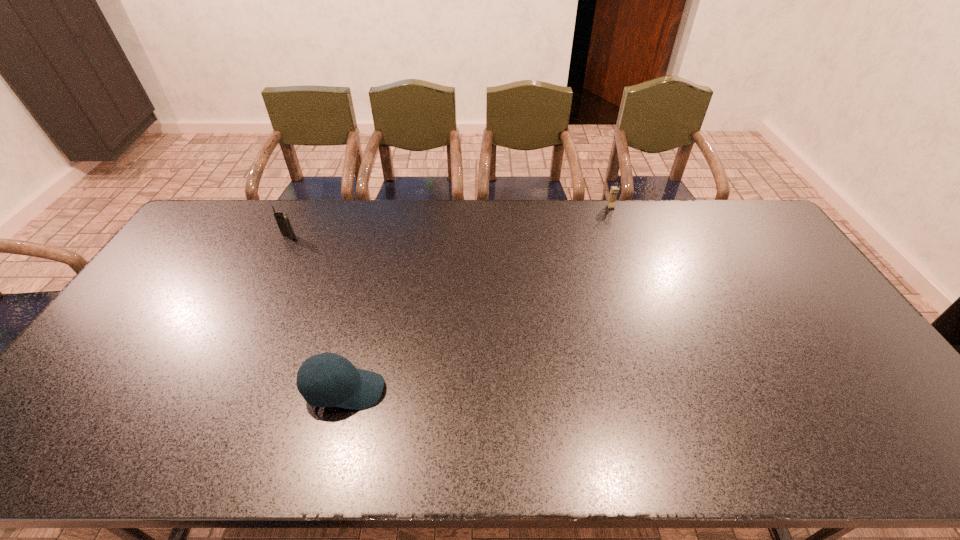
The image size is (960, 540). What are the coordinates of `vacant position at the near edge of the desktop` in the screenshot? It's located at (559, 463).

Find the location of a particular element. vacant space at the left edge of the desktop is located at coordinates (97, 372).

Image resolution: width=960 pixels, height=540 pixels. In the image, there is a desktop. Identify the location of free space at the right edge. (858, 346).

Where is `free space between the second object from left to right and the nearer cellular telephone`? This screenshot has width=960, height=540. free space between the second object from left to right and the nearer cellular telephone is located at coordinates (317, 313).

Locate an element on the screen. The width and height of the screenshot is (960, 540). empty location between the rightmost object and the leftmost object is located at coordinates (450, 222).

At what (x,y) coordinates should I click in order to perform the action: click on vacant area that lies between the left cellular telephone and the nearest object. Please return your answer as a coordinate pair (x, y). Looking at the image, I should click on (317, 313).

In order to click on free area in between the second farthest object and the right cellular telephone in this screenshot , I will do (x=450, y=222).

Locate an element on the screen. Image resolution: width=960 pixels, height=540 pixels. empty location between the baseball cap and the right cellular telephone is located at coordinates (478, 299).

You are a GUI agent. You are given a task and a screenshot of the screen. Output one action in this format:
    pyautogui.click(x=<x>, y=<y>)
    Task: Click on the vacant point located between the nearer cellular telephone and the farther cellular telephone
    The image size is (960, 540).
    Given the screenshot: What is the action you would take?
    pyautogui.click(x=450, y=222)

What are the coordinates of `vacant point located between the baseball cap and the farthest object` in the screenshot? It's located at (478, 299).